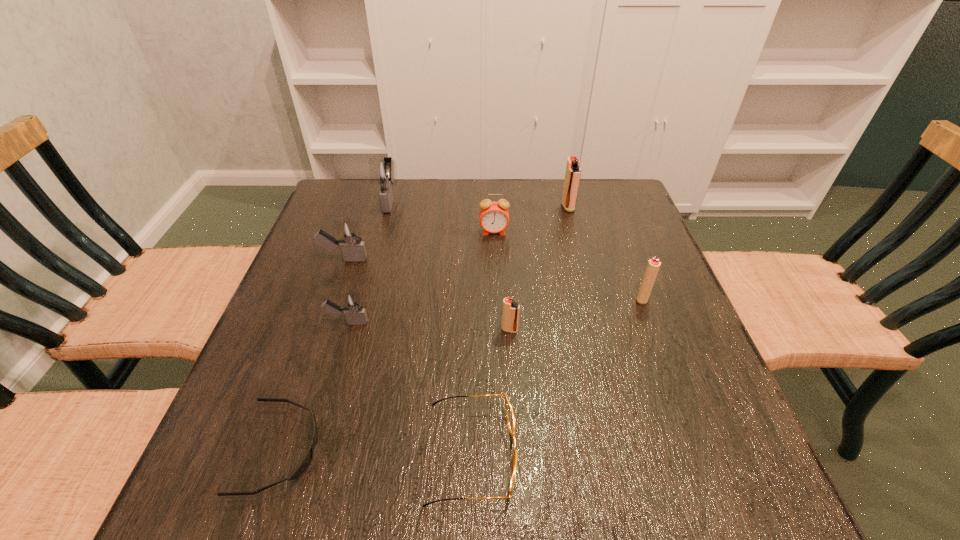
Locate an element on the screen. This screenshot has width=960, height=540. free space between the nearest red igniter and the second nearest red igniter is located at coordinates (576, 314).

This screenshot has height=540, width=960. In order to click on free spot between the third farthest object and the farthest gray igniter in this screenshot , I will do `click(443, 216)`.

This screenshot has width=960, height=540. I want to click on unoccupied area between the third farthest object and the smallest red igniter, so click(502, 281).

The image size is (960, 540). What are the coordinates of `free point between the biggest gray igniter and the eighth tallest object` in the screenshot? It's located at (431, 327).

You are a GUI agent. You are given a task and a screenshot of the screen. Output one action in this format:
    pyautogui.click(x=<x>, y=<y>)
    Task: Click on the vacant space that's between the seventh nearest object and the spectacles
    
    Given the screenshot: What is the action you would take?
    pyautogui.click(x=483, y=343)

Identify which object is the sixth nearest to the second biggest red igniter. Please provide its 2D coordinates. Your answer should be formatted as a tuple, i.e. [(x, y)], where the tuple contains the x and y coordinates of a point satisfying the conditions above.

[(353, 249)]

Find the location of a particular element. the second closest object to the smallest gray igniter is located at coordinates (308, 457).

The width and height of the screenshot is (960, 540). Find the location of `igniter that is the closest to the alarm clock`. igniter that is the closest to the alarm clock is located at coordinates (573, 173).

Select which igniter appears as the fourth closest to the spectacles. Please provide its 2D coordinates. Your answer should be formatted as a tuple, i.e. [(x, y)], where the tuple contains the x and y coordinates of a point satisfying the conditions above.

[(353, 249)]

Choose which red igniter is the second nearest neighbor to the eighth tallest object. Please provide its 2D coordinates. Your answer should be formatted as a tuple, i.e. [(x, y)], where the tuple contains the x and y coordinates of a point satisfying the conditions above.

[(653, 266)]